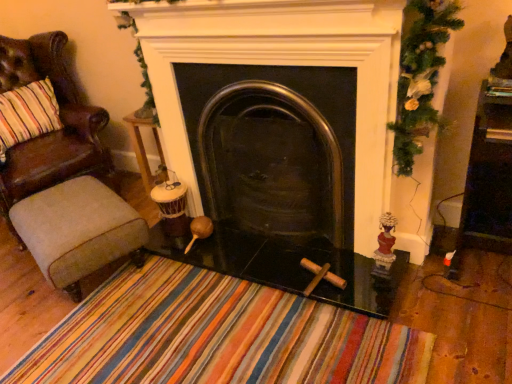
Identify the location of free point to the left of matte red figurine at right. This screenshot has height=384, width=512. (343, 269).